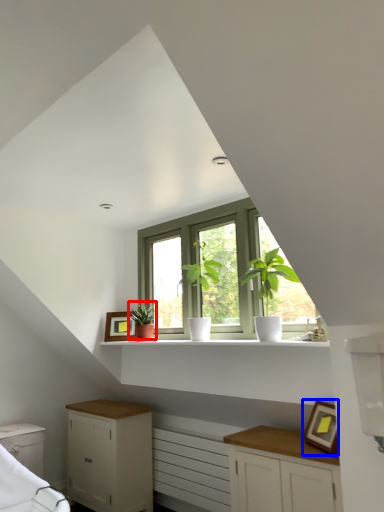
Question: Among these objects, which one is farthest to the camera, houseplant (highlighted by a red box) or picture frame (highlighted by a blue box)?

Choices:
 (A) houseplant
 (B) picture frame

Answer: (A)